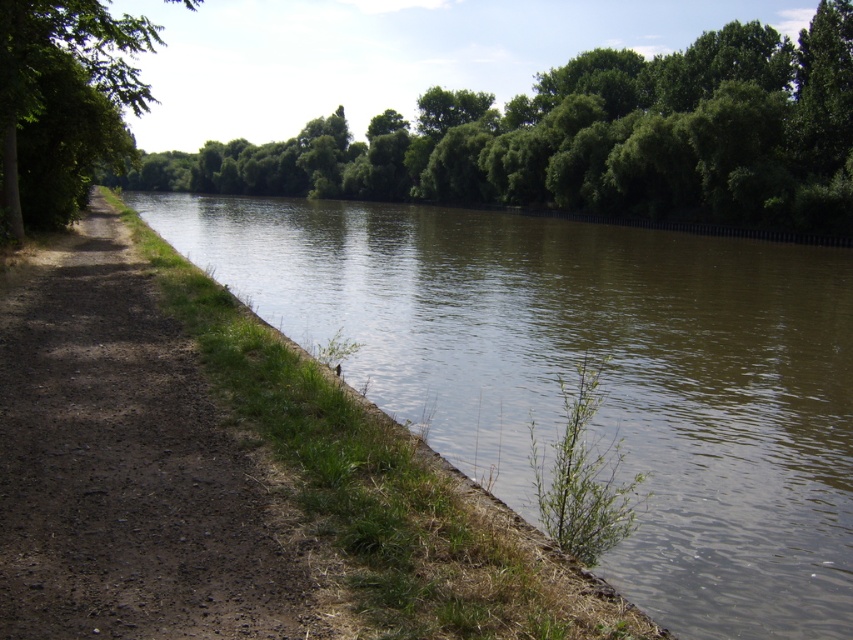
Question: Can you confirm if green grassy river at left is smaller than green leafy tree at upper center?

Choices:
 (A) yes
 (B) no

Answer: (A)

Question: Based on their relative distances, which object is nearer to the brown dirt path at left?

Choices:
 (A) green leafy tree at upper center
 (B) green leafy tree at left
 (C) green grassy river at left

Answer: (B)

Question: Is green grassy river at left closer to camera compared to green leafy tree at left?

Choices:
 (A) yes
 (B) no

Answer: (A)

Question: Which point is closer to the camera?

Choices:
 (A) (113, 35)
 (B) (728, 204)
 (C) (317, 337)

Answer: (C)

Question: Estimate the real-world distances between objects in this image. Which object is closer to the green leafy tree at upper center?

Choices:
 (A) green leafy tree at left
 (B) brown dirt path at left
 (C) green grassy river at left

Answer: (C)

Question: Considering the relative positions of green grassy river at left and green leafy tree at left in the image provided, where is green grassy river at left located with respect to green leafy tree at left?

Choices:
 (A) above
 (B) below

Answer: (B)